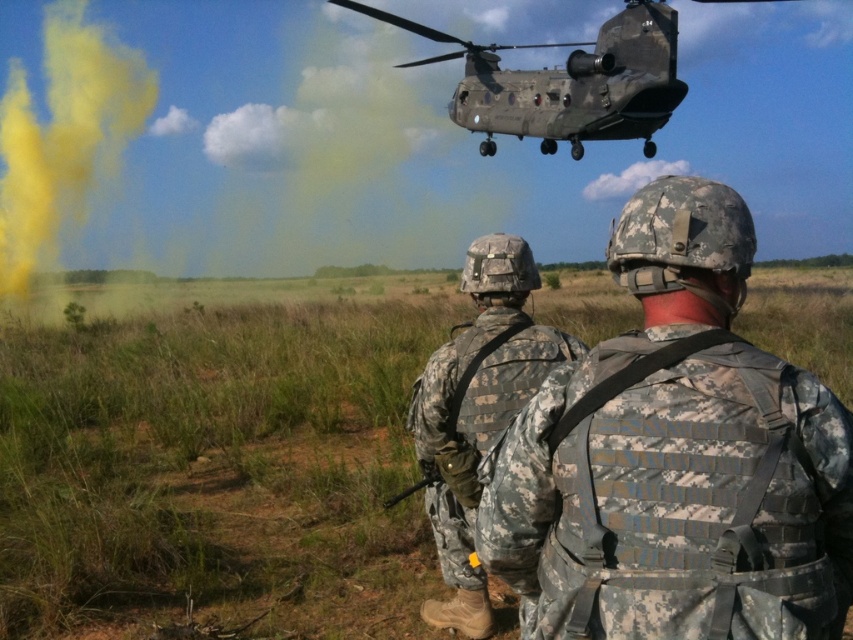
Between camouflage uniform at center and camouflage fabric uniform at center, which one has less height?

camouflage fabric uniform at center

Does camouflage uniform at center have a larger size compared to camouflage fabric uniform at center?

Yes.

Locate an element on the screen. This screenshot has height=640, width=853. camouflage uniform at center is located at coordinates (216, 461).

Who is more forward, (38, 628) or (728, 337)?

Positioned in front is point (728, 337).

Between camouflage uniform at center and camouflage fabric vest at center, which one appears on the left side from the viewer's perspective?

camouflage fabric vest at center is more to the left.

Does point (415, 301) lie behind point (724, 257)?

Yes, it is behind point (724, 257).

Locate an element on the screen. camouflage uniform at center is located at coordinates tap(216, 461).

Looking at this image, which is above, camouflage uniform at center or camouflage paint helicopter at upper center?

camouflage paint helicopter at upper center

Between camouflage uniform at center and camouflage paint helicopter at upper center, which one has less height?

Standing shorter between the two is camouflage uniform at center.

Who is more forward, [56,390] or [614,76]?

Point [56,390] is in front.

In order to click on camouflage uniform at center in this screenshot , I will do `click(216, 461)`.